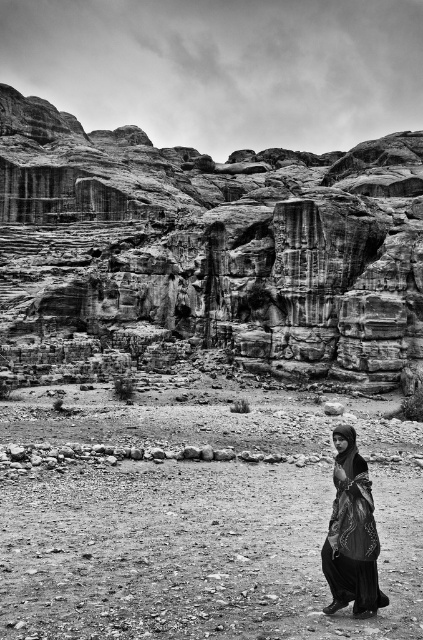
Question: Can you confirm if rugged stone cliffs at upper left is thinner than black satin dress at lower right?

Choices:
 (A) yes
 (B) no

Answer: (B)

Question: Does rugged stone cliffs at upper left have a greater width compared to dirt field at lower center?

Choices:
 (A) yes
 (B) no

Answer: (A)

Question: Which of the following is the closest to the observer?

Choices:
 (A) (104, 621)
 (B) (353, 602)
 (C) (275, 243)

Answer: (A)

Question: Which object is the farthest from the dirt field at lower center?

Choices:
 (A) black satin dress at lower right
 (B) rugged stone cliffs at upper left

Answer: (B)

Question: Which of the following is the farthest from the observer?

Choices:
 (A) dirt field at lower center
 (B) rugged stone cliffs at upper left

Answer: (B)

Question: Observing the image, what is the correct spatial positioning of dirt field at lower center in reference to black satin dress at lower right?

Choices:
 (A) left
 (B) right

Answer: (A)